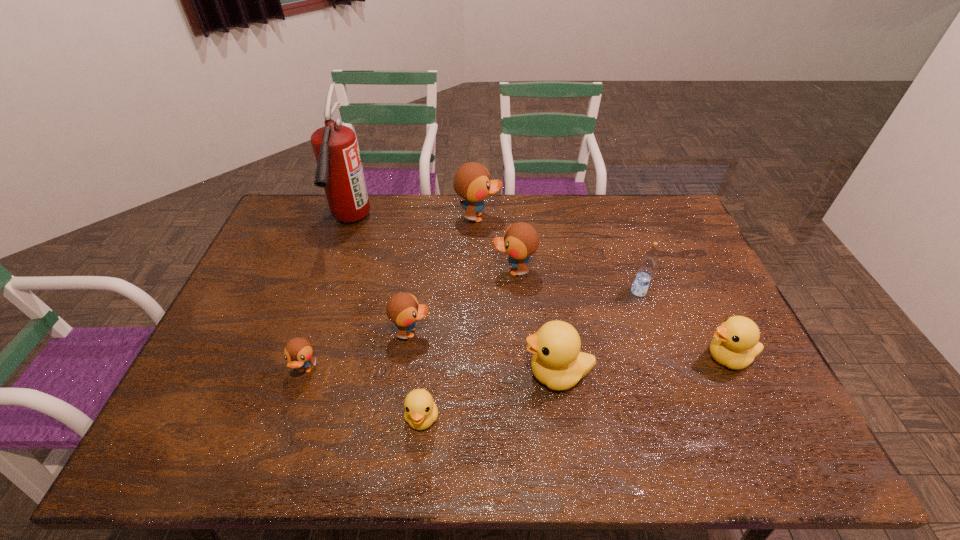
Where is `vacant space located 0.140m on the front-facing side of the leftmost duck`? This screenshot has width=960, height=540. vacant space located 0.140m on the front-facing side of the leftmost duck is located at coordinates (283, 438).

Find the location of `fire extinguisher that is at the far edge`. fire extinguisher that is at the far edge is located at coordinates (339, 171).

I want to click on duck that is at the far edge, so click(472, 182).

Find the location of a particular element. This screenshot has height=540, width=960. object present at the near edge is located at coordinates (421, 411).

Where is `object located at the right edge`? object located at the right edge is located at coordinates coord(735,344).

Where is `free location at the far edge of the desktop`? free location at the far edge of the desktop is located at coordinates (378, 213).

Locate an element on the screen. The height and width of the screenshot is (540, 960). vacant space at the near edge of the desktop is located at coordinates (720, 457).

You are a GUI agent. You are given a task and a screenshot of the screen. Output one action in this format:
    pyautogui.click(x=<x>, y=<y>)
    Task: Click on the free space at the right edge of the desktop
    The image size is (960, 540).
    Given the screenshot: What is the action you would take?
    pyautogui.click(x=661, y=275)

This screenshot has height=540, width=960. What are the coordinates of `blank space at the far left corner of the desktop` in the screenshot? It's located at (305, 230).

Identify the location of vacant space that's between the leftmost yellow duck and the seventh nearest object. (468, 344).